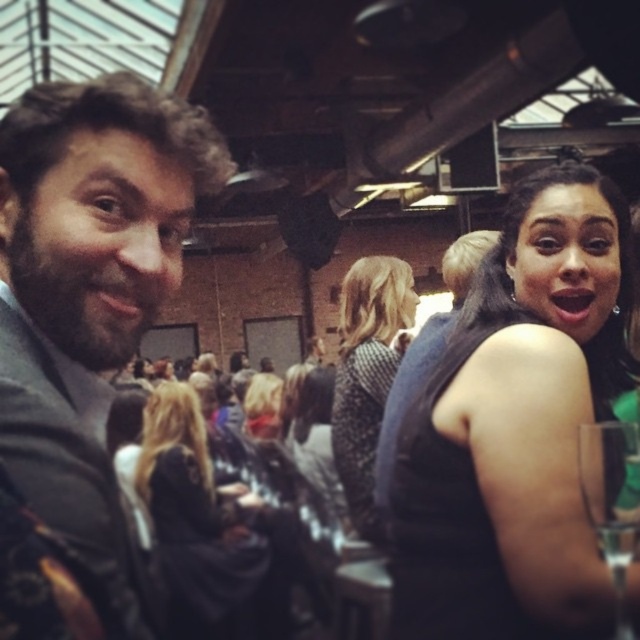
You are at a party and want to take a photo with both the black matte dress at upper right and the patterned sweater at center. Since you can only focus on one object at a time, which one should you aim your camera at first to ensure both are in the frame?

You should aim your camera at the patterned sweater at center first because the black matte dress at upper right is to the right of it, ensuring both are within the frame when centered on the sweater.

You are a bartender preparing to place a drink on a table. You have a clear glass wine glass at lower right. The table has a black fabric dress at upper right placed on it. Considering the sizes, can the wine glass fit next to the dress without overlapping?

The clear glass wine glass at lower right is narrower than the black fabric dress at upper right, so it should fit next to it without overlapping.

You are at a social event in this space and want to grab the clear glass wine glass at lower right. Considering your outstretched arm reaches 80 centimeters, can you reach it without moving your position?

The clear glass wine glass at lower right is 93.13 centimeters away from you, which is beyond your 80 centimeter reach. You cannot reach it without moving closer.